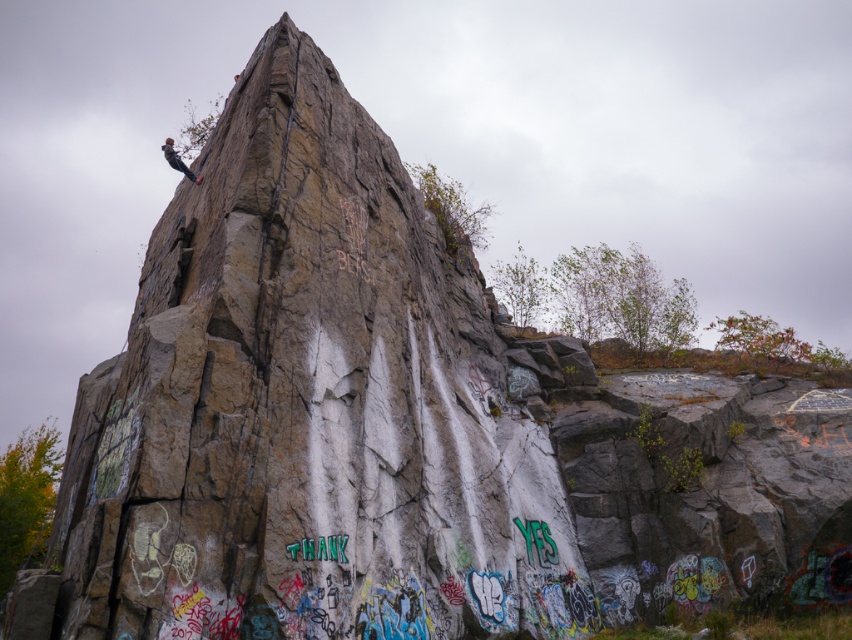
You are a photographer standing at the base of the rock formation. You want to take a photo that includes both point [193,316] and point [199,179]. Which point will appear larger in the photo?

Point [193,316] is closer to the camera than point [199,179], so it will appear larger in the photo.

You are a hiker planning to climb the rough stone rock at center. You notice the matte black rock climber at upper left on another rock. Which rock is bigger?

The rough stone rock at center is smaller than the matte black rock climber at upper left, so the matte black rock climber at upper left is on a bigger rock.

You are planning to place a large sculpture exactly in the middle of the rough stone rock at center. Considering the size of the matte black rock climber at upper left, will the sculpture fit without overlapping the climber?

The rough stone rock at center is wider than the matte black rock climber at upper left. Since the sculpture is placed in the middle of the rough stone rock at center, it should not overlap with the climber as they are positioned at different areas of the rock.